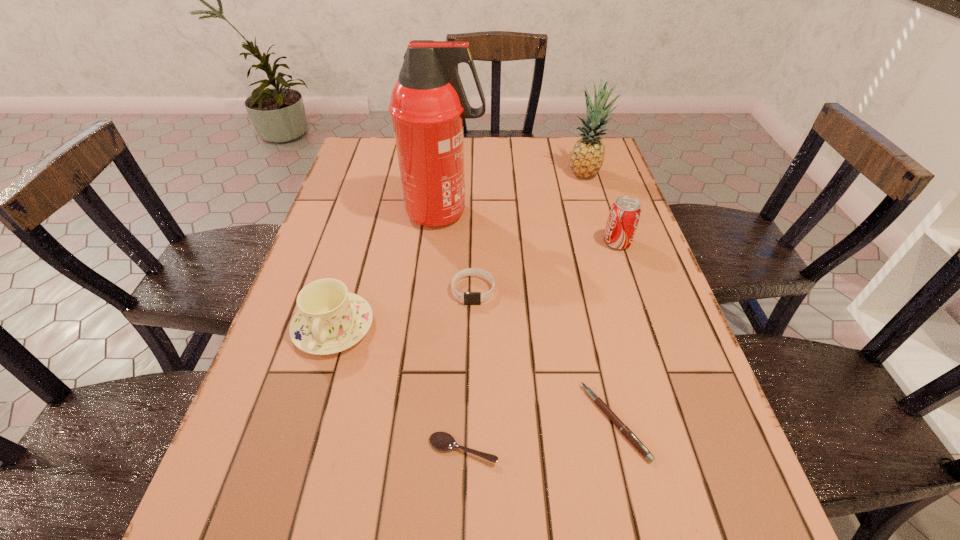
Locate an element on the screen. Image resolution: width=960 pixels, height=540 pixels. soupspoon is located at coordinates (442, 441).

At what (x,y) coordinates should I click in order to perform the action: click on free space located on the trigger side of the tallest object. Please return your answer as a coordinate pair (x, y). Looking at the image, I should click on (541, 213).

Where is `blank space located on the back of the farthest object`? blank space located on the back of the farthest object is located at coordinates pos(578,149).

Where is `vacant region located 0.100m on the back of the fifth shortest object`? Image resolution: width=960 pixels, height=540 pixels. vacant region located 0.100m on the back of the fifth shortest object is located at coordinates (607, 211).

Where is `free space located on the handle side of the chinaware`? This screenshot has height=540, width=960. free space located on the handle side of the chinaware is located at coordinates (317, 382).

What are the coordinates of `vacant space located 0.270m on the outer surface of the fifth tallest object` in the screenshot? It's located at (471, 416).

Where is `vacant region located at the nib of the pen`? This screenshot has width=960, height=540. vacant region located at the nib of the pen is located at coordinates (510, 421).

Identify the location of vacant space located 0.340m at the nib of the pen. The height and width of the screenshot is (540, 960). (398, 421).

Find the location of a particular element. This screenshot has width=960, height=540. vacant region located at the nib of the pen is located at coordinates [554, 421].

You are a GUI agent. You are given a task and a screenshot of the screen. Output one action in this format:
    pyautogui.click(x=<x>, y=<y>)
    Task: Click on the vacant region located on the back of the shortest object
    This screenshot has height=540, width=960.
    Given the screenshot: What is the action you would take?
    pyautogui.click(x=467, y=342)